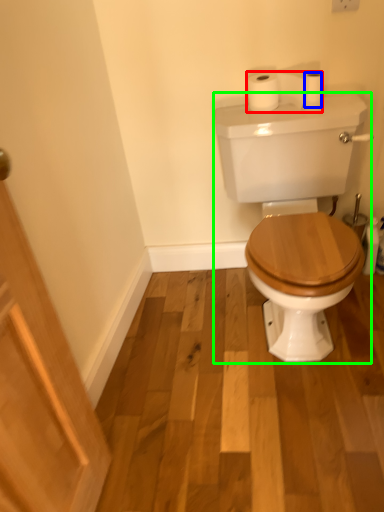
Question: Which is farther away from toilet paper (highlighted by a red box)? toilet paper (highlighted by a blue box) or porcelain (highlighted by a green box)?

Choices:
 (A) toilet paper
 (B) porcelain

Answer: (B)